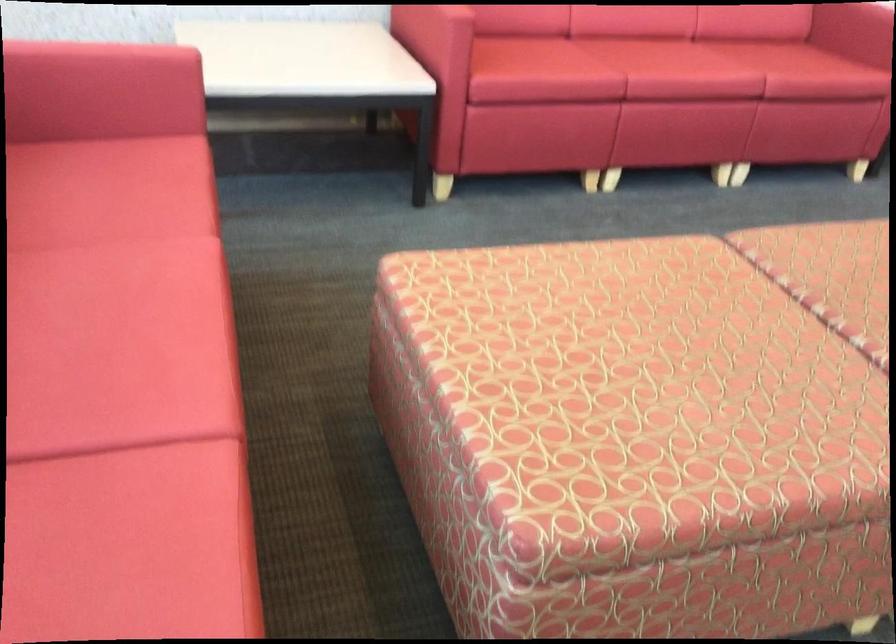
Find the location of a particular element. red sofa armrest is located at coordinates (102, 53).